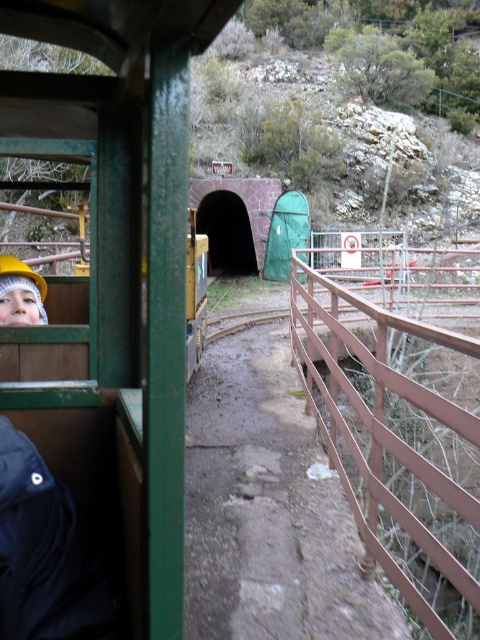
Between metallic green train at left and brown metal fence at right, which one appears on the right side from the viewer's perspective?

Positioned to the right is brown metal fence at right.

At what (x,y) coordinates should I click in order to perform the action: click on metallic green train at left. Please return your answer as a coordinate pair (x, y). This screenshot has height=640, width=480. Looking at the image, I should click on (115, 276).

The height and width of the screenshot is (640, 480). Find the location of `metallic green train at left`. metallic green train at left is located at coordinates (115, 276).

Is green matte tunnel at center wider than hard hat at left?

Correct, the width of green matte tunnel at center exceeds that of hard hat at left.

Does point (245, 211) come closer to viewer compared to point (37, 298)?

No.

Is point (218, 257) positioned in front of point (0, 292)?

No, (218, 257) is further to viewer.

Find the location of a particular element. green matte tunnel at center is located at coordinates (227, 232).

Does metallic green train at left appear over hard hat at left?

Indeed, metallic green train at left is positioned over hard hat at left.

Find the location of a particular element. The image size is (480, 640). metallic green train at left is located at coordinates (115, 276).

This screenshot has height=640, width=480. Find the location of `metallic green train at left`. metallic green train at left is located at coordinates (115, 276).